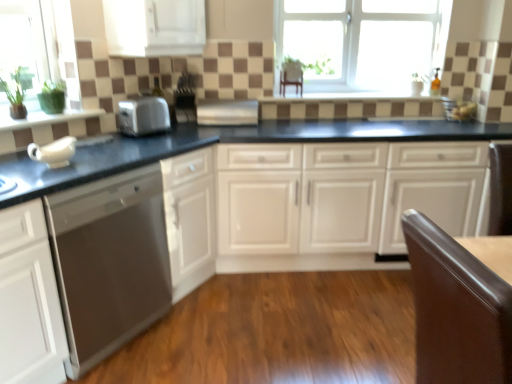
Question: From the image's perspective, is satin silver toaster at center located above black granite countertop at center?

Choices:
 (A) yes
 (B) no

Answer: (A)

Question: Is satin silver toaster at center not inside black granite countertop at center?

Choices:
 (A) yes
 (B) no

Answer: (A)

Question: Can you confirm if satin silver toaster at center is shorter than black granite countertop at center?

Choices:
 (A) no
 (B) yes

Answer: (B)

Question: Is satin silver toaster at center with black granite countertop at center?

Choices:
 (A) no
 (B) yes

Answer: (A)

Question: Considering the relative sizes of satin silver toaster at center and black granite countertop at center in the image provided, is satin silver toaster at center wider than black granite countertop at center?

Choices:
 (A) yes
 (B) no

Answer: (B)

Question: Visually, is white glossy cabinet at upper center, the second cabinetry from the bottom, positioned to the left or to the right of satin silver toaster at center, marked as the 2th appliance in a left-to-right arrangement?

Choices:
 (A) left
 (B) right

Answer: (A)

Question: Relative to satin silver toaster at center, which appears as the first appliance when viewed from the right, is white glossy cabinet at upper center, the second cabinetry from the bottom, in front or behind?

Choices:
 (A) front
 (B) behind

Answer: (A)

Question: Is point (176, 14) positioned closer to the camera than point (252, 119)?

Choices:
 (A) farther
 (B) closer

Answer: (B)

Question: From a real-world perspective, relative to satin silver toaster at center, which appears as the first appliance when viewed from the right, is white glossy cabinet at upper center, the second cabinetry from the bottom, vertically above or below?

Choices:
 (A) above
 (B) below

Answer: (A)

Question: Relative to satin stainless steel dishwasher at left, is white glossy cabinets at center, the 2th cabinetry in the left-to-right sequence, in front or behind?

Choices:
 (A) behind
 (B) front

Answer: (A)

Question: From a real-world perspective, is white glossy cabinets at center, which is the second cabinetry in top-to-bottom order, positioned above or below satin stainless steel dishwasher at left?

Choices:
 (A) above
 (B) below

Answer: (B)

Question: Considering the positions of point pyautogui.click(x=387, y=249) and point pyautogui.click(x=164, y=248), is point pyautogui.click(x=387, y=249) closer or farther from the camera than point pyautogui.click(x=164, y=248)?

Choices:
 (A) closer
 (B) farther

Answer: (B)

Question: Visually, is white glossy cabinets at center, the first cabinetry from the right, positioned to the left or to the right of satin stainless steel dishwasher at left?

Choices:
 (A) left
 (B) right

Answer: (B)

Question: In terms of height, does white glass window at upper center look taller or shorter compared to satin silver toaster at center, arranged as the 2th appliance when viewed from the right?

Choices:
 (A) tall
 (B) short

Answer: (A)

Question: Does point (442, 41) appear closer or farther from the camera than point (186, 87)?

Choices:
 (A) farther
 (B) closer

Answer: (A)